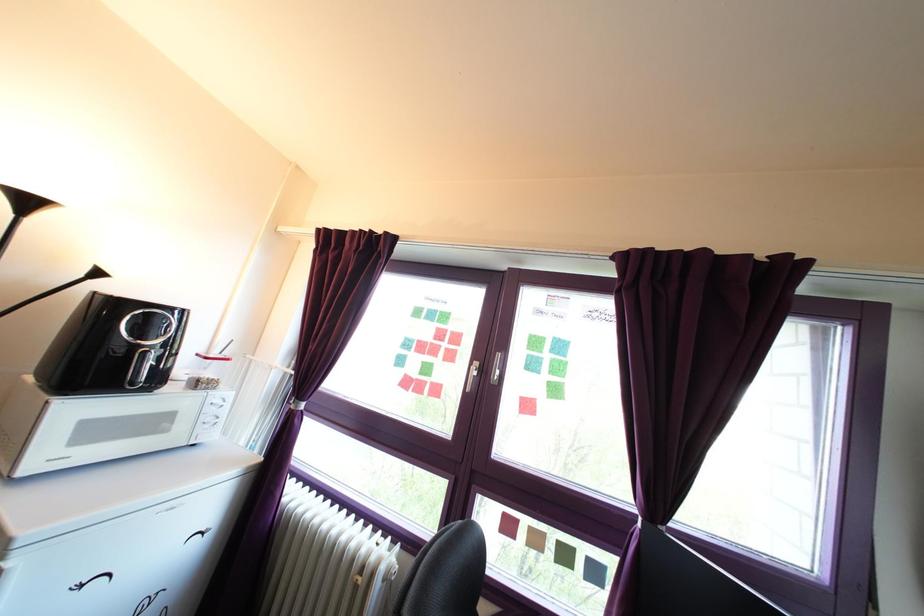
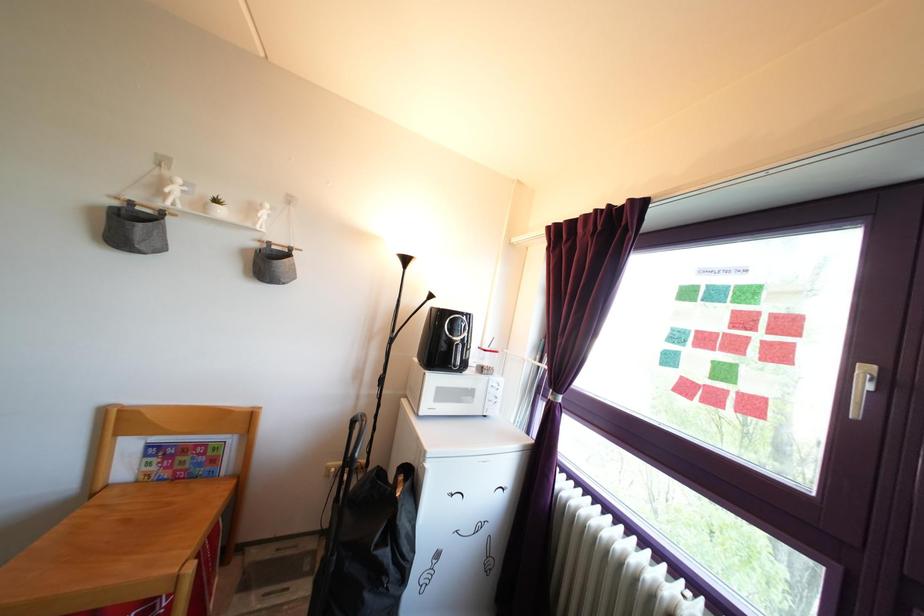
Locate, in the second image, the point that corresponds to (222,410) in the first image.

(499, 394)